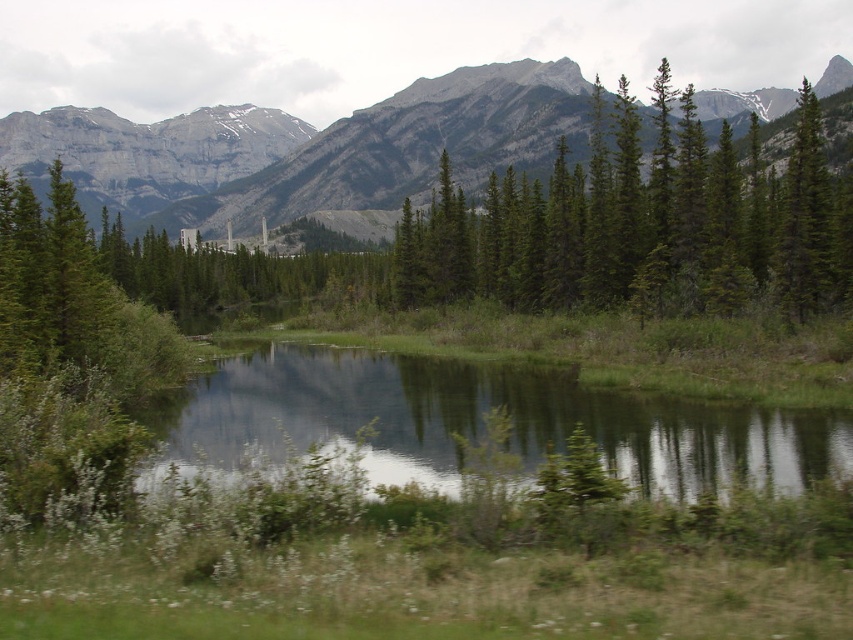
You are a hiker standing at the water edge. You see the green textured trees at upper right and the gray rock mountain at upper center. Which one is farther from your current position?

The gray rock mountain at upper center is closer to you than the green textured trees at upper right, so the green textured trees at upper right is farther from your current position.

You are planning to take a photo of the green textured trees at upper right and the green grassy pond at center. Which object will occupy more space in the photo frame?

The green textured trees at upper right will occupy more space in the photo frame because their width is larger than the green grassy pond at center.